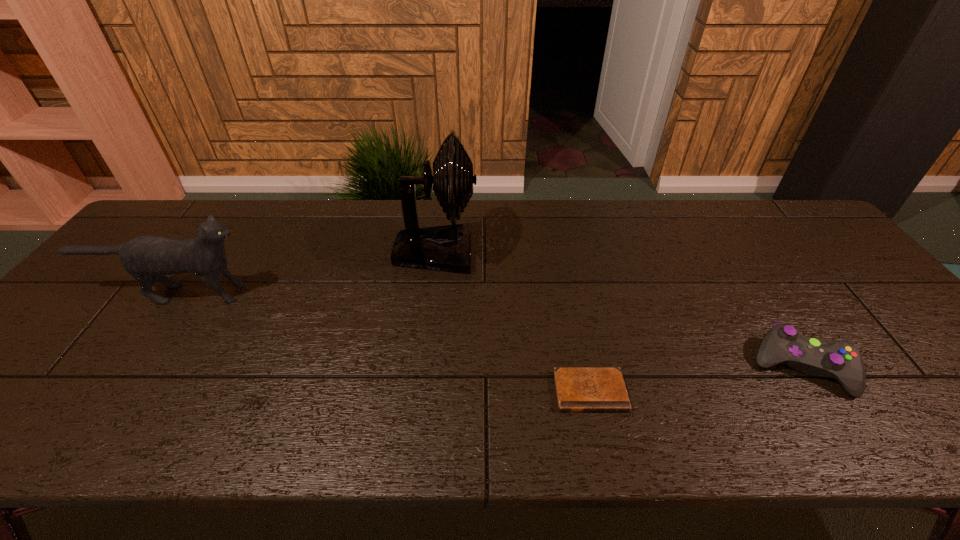
Identify the location of object that is the nearest to the diary. (839, 359).

Locate an element on the screen. This screenshot has width=960, height=540. free space that satisfies the following two spatial constraints: 1. in front of the farthest object to blow air; 2. on the left side of the rightmost object is located at coordinates (422, 367).

The height and width of the screenshot is (540, 960). I want to click on vacant space that satisfies the following two spatial constraints: 1. in front of the control to blow air; 2. on the right side of the second object from left to right, so click(422, 367).

Find the location of a particular element. free space in the image that satisfies the following two spatial constraints: 1. in front of the rightmost object to blow air; 2. on the left side of the farthest object is located at coordinates (422, 367).

Find the location of a particular element. The image size is (960, 540). blank space that satisfies the following two spatial constraints: 1. in front of the fan to blow air; 2. on the back side of the rightmost object is located at coordinates (422, 367).

Identify the location of blank area in the image that satisfies the following two spatial constraints: 1. on the front-facing side of the third nearest object; 2. on the back side of the third tallest object. This screenshot has height=540, width=960. (123, 367).